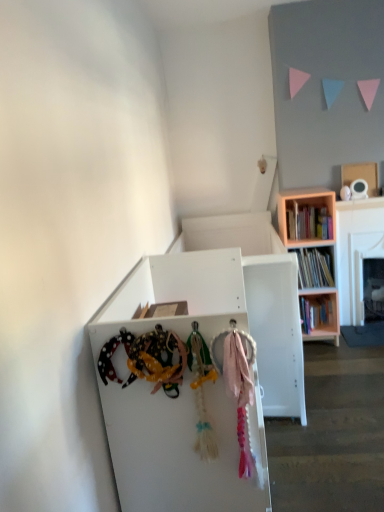
Identify the location of unoccupied area in front of wooden bookcase at upper right. (330, 355).